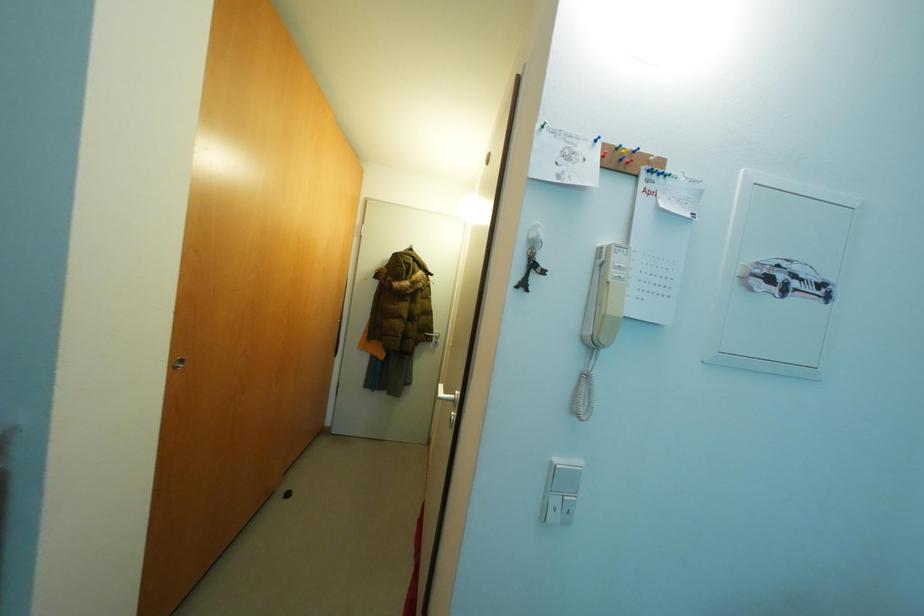
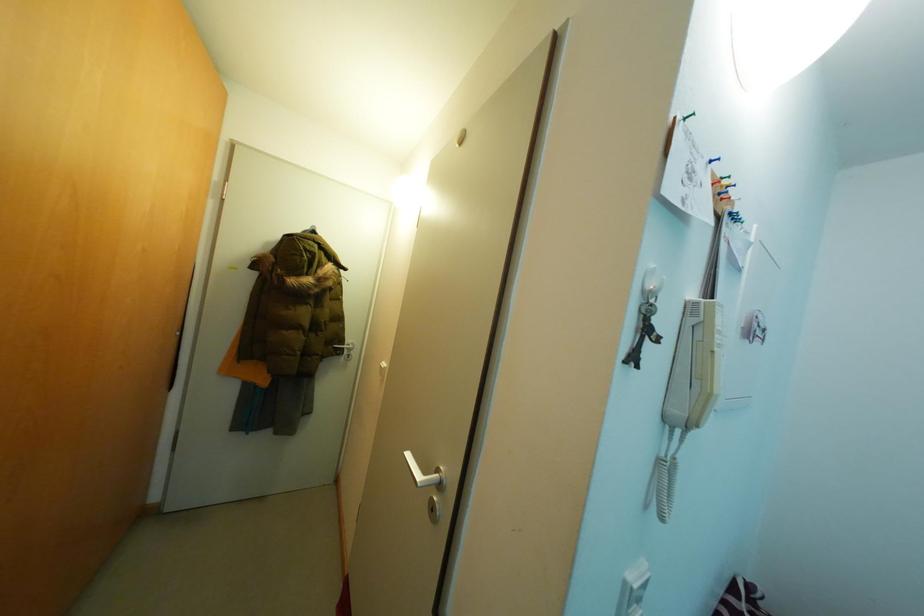
Question: How did the camera likely rotate?

Choices:
 (A) Left
 (B) Right
 (C) Up
 (D) Down

Answer: (B)